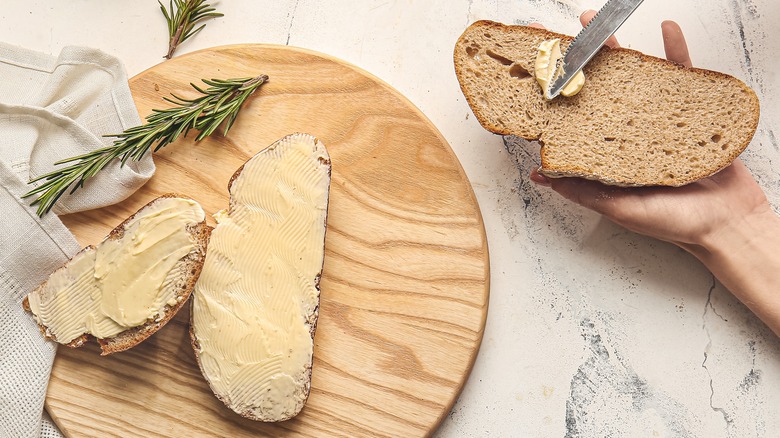
You are a GUI agent. You are given a task and a screenshot of the screen. Output one action in this format:
    pyautogui.click(x=<x>, y=<y>)
    Task: Click on the napkin
    The width and height of the screenshot is (780, 438).
    Given the screenshot: What is the action you would take?
    pyautogui.click(x=43, y=112), pyautogui.click(x=26, y=242)